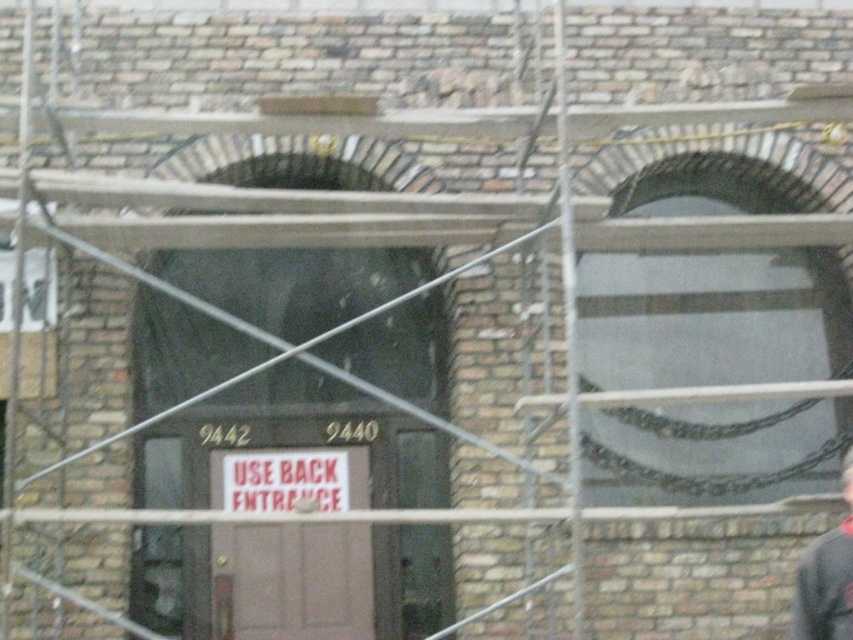
Question: Where is brown matte door at center located in relation to metal scaffolding at right in the image?

Choices:
 (A) right
 (B) left

Answer: (B)

Question: Which object appears closest to the camera in this image?

Choices:
 (A) gray fabric construction worker at lower right
 (B) brown matte door at center
 (C) metal scaffolding at right

Answer: (A)

Question: Considering the real-world distances, which object is farthest from the brown matte door at center?

Choices:
 (A) metal scaffolding at right
 (B) gray fabric construction worker at lower right

Answer: (B)

Question: Does brown matte door at center have a smaller size compared to gray fabric construction worker at lower right?

Choices:
 (A) no
 (B) yes

Answer: (A)

Question: Is brown matte door at center closer to the viewer compared to gray fabric construction worker at lower right?

Choices:
 (A) yes
 (B) no

Answer: (B)

Question: Estimate the real-world distances between objects in this image. Which object is closer to the metal scaffolding at right?

Choices:
 (A) brown matte door at center
 (B) gray fabric construction worker at lower right

Answer: (B)